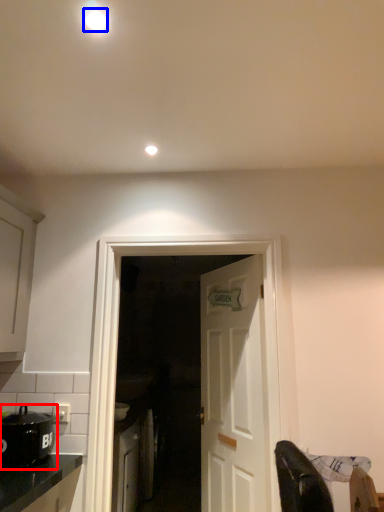
Question: Which object appears closest to the camera in this image, kitchen appliance (highlighted by a red box) or lighting (highlighted by a blue box)?

Choices:
 (A) kitchen appliance
 (B) lighting

Answer: (B)